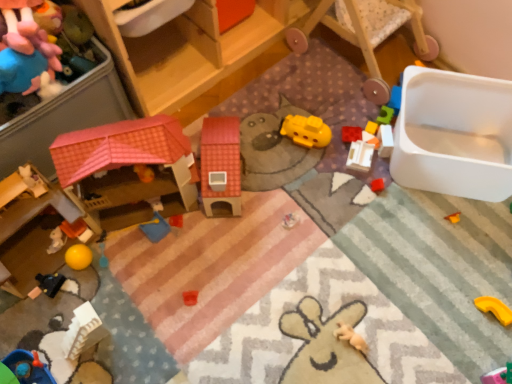
Identify the location of free space in front of yellow matte block at upper right, positioned as the 3th toy in right-to-left order. The width and height of the screenshot is (512, 384). (370, 182).